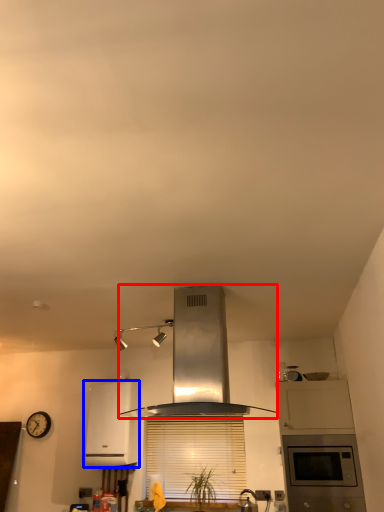
Question: Which object is further to the camera taking this photo, home appliance (highlighted by a red box) or home appliance (highlighted by a blue box)?

Choices:
 (A) home appliance
 (B) home appliance

Answer: (B)